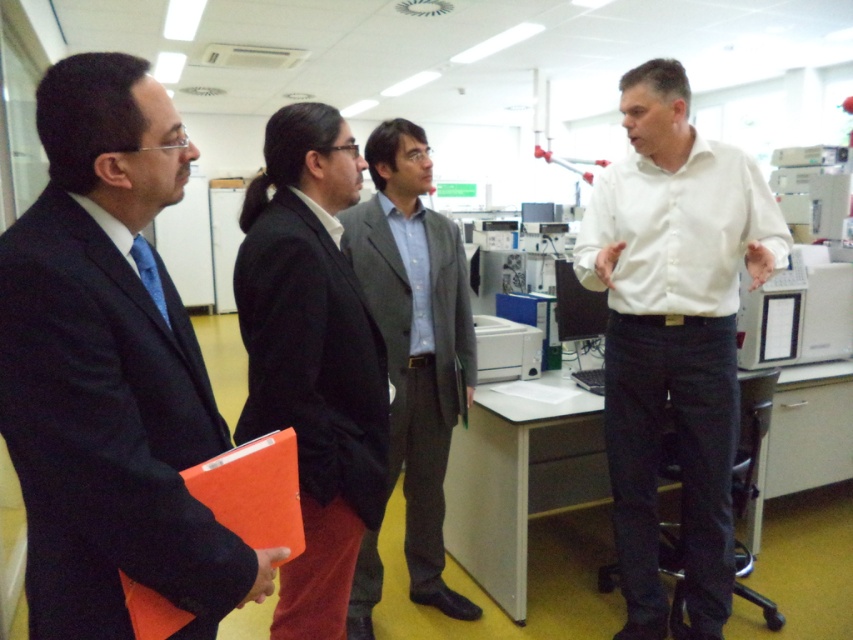
Is point (131, 81) closer to viewer compared to point (666, 150)?

Yes, it is.

Between black suit at left and white shirt at center, which one has less height?

With less height is black suit at left.

Locate an element on the screen. The height and width of the screenshot is (640, 853). black suit at left is located at coordinates (109, 371).

What do you see at coordinates (672, 333) in the screenshot? This screenshot has width=853, height=640. I see `white shirt at center` at bounding box center [672, 333].

Between white shirt at center and gray wool suit at center, which one has more height?

white shirt at center

Between point (733, 406) and point (460, 273), which one is positioned in front?

Point (733, 406) is in front.

Find the location of a particular element. The width and height of the screenshot is (853, 640). white shirt at center is located at coordinates [672, 333].

Between point (262, 184) and point (218, 474), which one is positioned behind?

Positioned behind is point (262, 184).

Between point (351, 376) and point (289, 540), which one is positioned in front?

Positioned in front is point (289, 540).

What do you see at coordinates (312, 356) in the screenshot? Image resolution: width=853 pixels, height=640 pixels. I see `black suit at center` at bounding box center [312, 356].

Find the location of `black suit at center`. black suit at center is located at coordinates (312, 356).